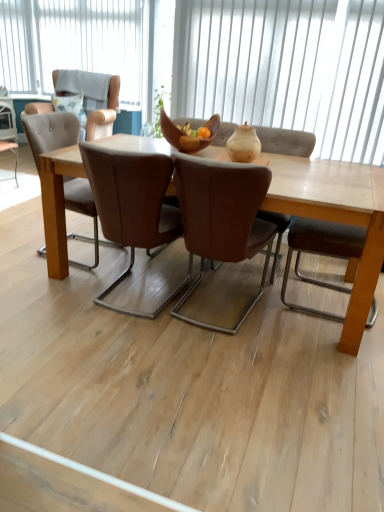
Where is `free space in front of brown leather chair at center, which is counted as the 1th chair, starting from the right`? The image size is (384, 512). free space in front of brown leather chair at center, which is counted as the 1th chair, starting from the right is located at coordinates (223, 361).